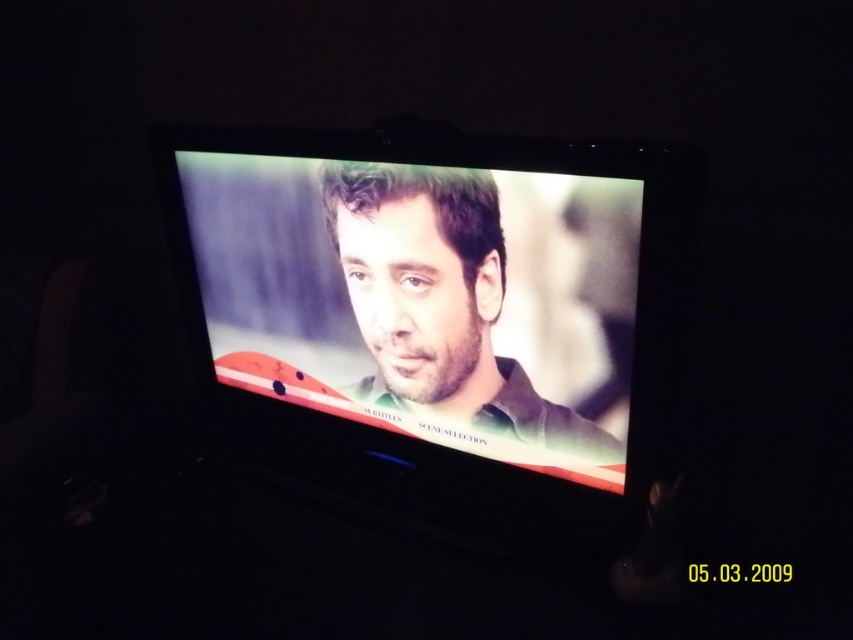
Question: Does matte black screen at center come behind matte green shirt at center?

Choices:
 (A) no
 (B) yes

Answer: (A)

Question: Is matte black screen at center to the left of matte green shirt at center from the viewer's perspective?

Choices:
 (A) yes
 (B) no

Answer: (A)

Question: Estimate the real-world distances between objects in this image. Which object is closer to the matte green shirt at center?

Choices:
 (A) matte black face at center
 (B) matte black screen at center

Answer: (A)

Question: Which object is closer to the camera taking this photo?

Choices:
 (A) matte black screen at center
 (B) matte green shirt at center
 (C) matte black face at center

Answer: (A)

Question: Which point appears closest to the camera in this image?

Choices:
 (A) (486, 260)
 (B) (338, 440)

Answer: (A)

Question: Does matte black face at center lie behind matte green shirt at center?

Choices:
 (A) yes
 (B) no

Answer: (B)